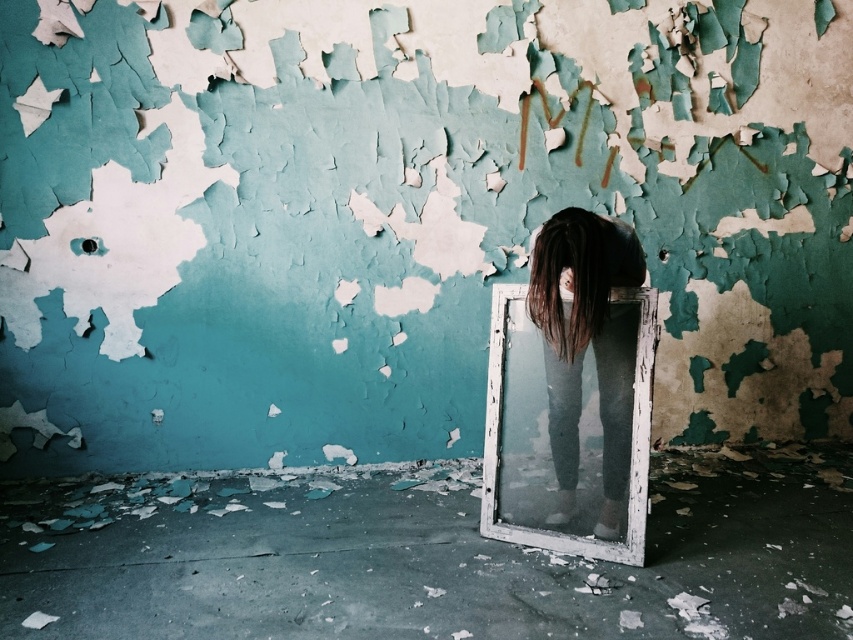
Which is above, dark brown hair at center or dark brown silky hair at center?

dark brown silky hair at center is higher up.

From the picture: Can you confirm if dark brown hair at center is positioned to the right of dark brown silky hair at center?

Correct, you'll find dark brown hair at center to the right of dark brown silky hair at center.

This screenshot has height=640, width=853. What do you see at coordinates (585, 346) in the screenshot?
I see `dark brown hair at center` at bounding box center [585, 346].

Where is `dark brown hair at center`? This screenshot has width=853, height=640. dark brown hair at center is located at coordinates (585, 346).